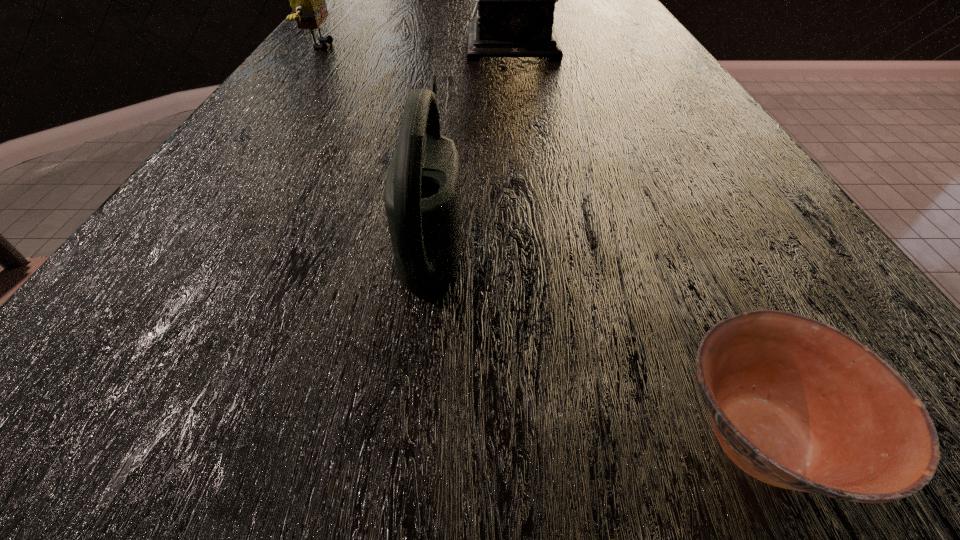
Find the location of `free space in the image that satisfies the following two spatial constraints: 1. on the spout of the bowl; 2. on the right side of the second nearest object`. free space in the image that satisfies the following two spatial constraints: 1. on the spout of the bowl; 2. on the right side of the second nearest object is located at coordinates tap(409, 438).

Where is `free space that satisfies the following two spatial constraints: 1. on the horn of the tallest object; 2. on the spout of the watering can`? free space that satisfies the following two spatial constraints: 1. on the horn of the tallest object; 2. on the spout of the watering can is located at coordinates (559, 232).